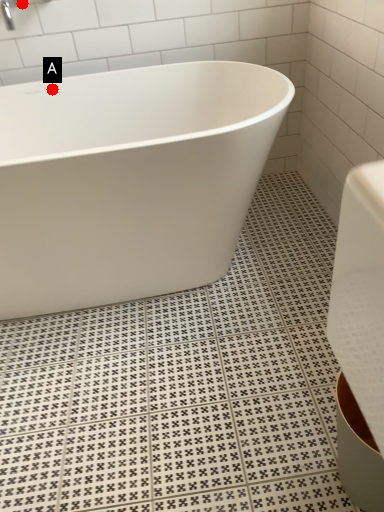
Question: Two points are circled on the image, labeled by A and B beside each circle. Which point is further to the camera?

Choices:
 (A) A is further
 (B) B is further

Answer: (A)